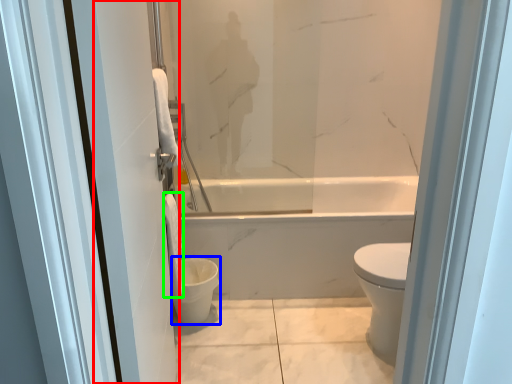
Question: Considering the real-world distances, which object is farthest from screen door (highlighted by a red box)? toilet bowl (highlighted by a blue box) or toilet paper (highlighted by a green box)?

Choices:
 (A) toilet bowl
 (B) toilet paper

Answer: (A)